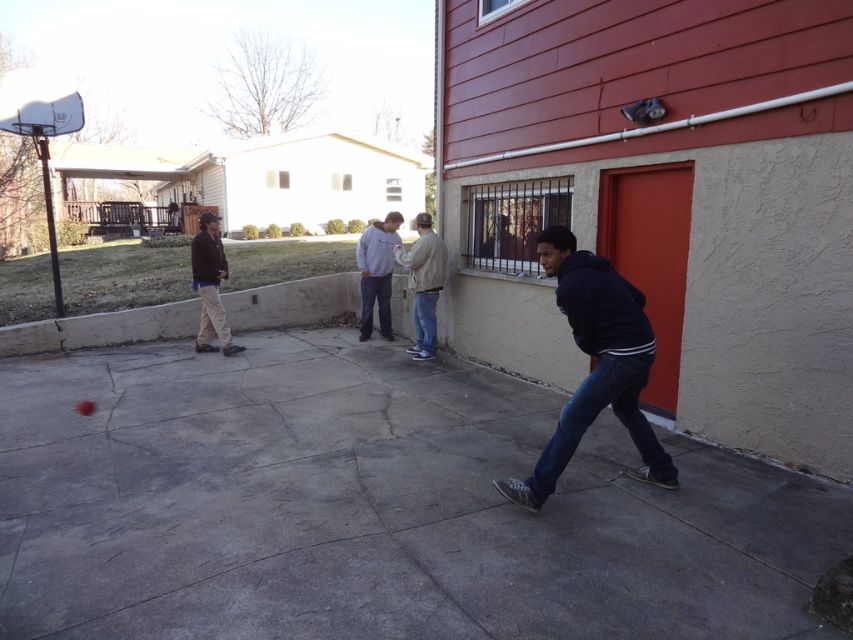
Question: Which object is closer to the camera taking this photo?

Choices:
 (A) light beige jacket at center
 (B) gray concrete pavement at center
 (C) dark blue hoodie at center
 (D) khaki pants at left

Answer: (C)

Question: Which of the following is the closest to the observer?

Choices:
 (A) (61, 314)
 (B) (230, 348)
 (C) (427, 317)
 (D) (573, 588)

Answer: (D)

Question: Observing the image, what is the correct spatial positioning of light beige jacket at center in reference to light gray hoodie at center?

Choices:
 (A) left
 (B) right

Answer: (B)

Question: Which of the following is the closest to the observer?

Choices:
 (A) (397, 220)
 (B) (621, 291)
 (C) (444, 260)

Answer: (B)

Question: Can you confirm if white plastic basketball hoop at upper left is positioned to the left of light gray hoodie at center?

Choices:
 (A) yes
 (B) no

Answer: (A)

Question: From the image, what is the correct spatial relationship of khaki pants at left in relation to light gray hoodie at center?

Choices:
 (A) above
 (B) below

Answer: (A)